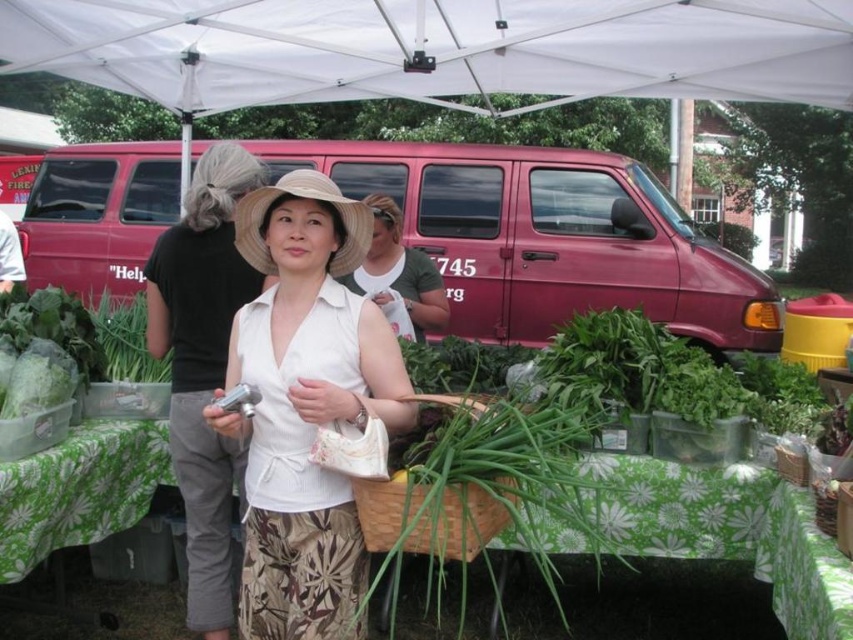
You are a photographer at the market and want to take a photo of the white matte dress at center and the beige straw hat at center. However, you notice that one of them is blocking the other. Which object is blocking the other?

The white matte dress at center is blocking the beige straw hat at center because it is in front of it.

Based on the photo, you are standing at the point labeled point (320, 173) and want to walk to the point labeled point (302, 273). Which direction should you face to move towards your destination?

You should face towards the direction of point (302, 273) because it is in front of point (320, 173).